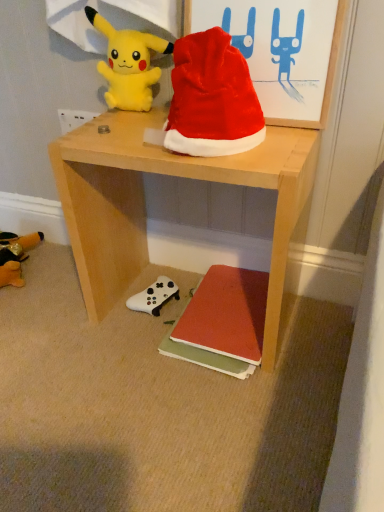
Question: Is white plastic power outlet at upper left oriented towards red matte book at lower center?

Choices:
 (A) no
 (B) yes

Answer: (A)

Question: From the image's perspective, is white plastic power outlet at upper left on top of red matte book at lower center?

Choices:
 (A) yes
 (B) no

Answer: (A)

Question: Considering the relative positions of white plastic power outlet at upper left and red matte book at lower center in the image provided, is white plastic power outlet at upper left to the left of red matte book at lower center from the viewer's perspective?

Choices:
 (A) yes
 (B) no

Answer: (A)

Question: From a real-world perspective, does white plastic power outlet at upper left stand above red matte book at lower center?

Choices:
 (A) no
 (B) yes

Answer: (B)

Question: Considering the relative sizes of white plastic power outlet at upper left and red matte book at lower center in the image provided, is white plastic power outlet at upper left bigger than red matte book at lower center?

Choices:
 (A) yes
 (B) no

Answer: (B)

Question: Considering the positions of point (66, 123) and point (104, 64), is point (66, 123) closer or farther from the camera than point (104, 64)?

Choices:
 (A) farther
 (B) closer

Answer: (A)

Question: Is white plastic power outlet at upper left in front of or behind yellow plush at upper left in the image?

Choices:
 (A) front
 (B) behind

Answer: (B)

Question: From a real-world perspective, relative to yellow plush at upper left, is white plastic power outlet at upper left vertically above or below?

Choices:
 (A) below
 (B) above

Answer: (A)

Question: Based on their positions, is white plastic power outlet at upper left located to the left or right of yellow plush at upper left?

Choices:
 (A) right
 (B) left

Answer: (B)

Question: Considering the positions of yellow plush at upper left and red velvet santa hat at upper center in the image, is yellow plush at upper left wider or thinner than red velvet santa hat at upper center?

Choices:
 (A) thin
 (B) wide

Answer: (A)

Question: Considering their positions, is yellow plush at upper left located in front of or behind red velvet santa hat at upper center?

Choices:
 (A) behind
 (B) front

Answer: (A)

Question: Is yellow plush at upper left bigger or smaller than red velvet santa hat at upper center?

Choices:
 (A) big
 (B) small

Answer: (B)

Question: Is yellow plush at upper left inside the boundaries of red velvet santa hat at upper center, or outside?

Choices:
 (A) outside
 (B) inside

Answer: (A)

Question: From the image's perspective, is light wood desk at center above or below yellow plush at upper left?

Choices:
 (A) above
 (B) below

Answer: (B)

Question: Considering the positions of light wood desk at center and yellow plush at upper left in the image, is light wood desk at center bigger or smaller than yellow plush at upper left?

Choices:
 (A) small
 (B) big

Answer: (B)